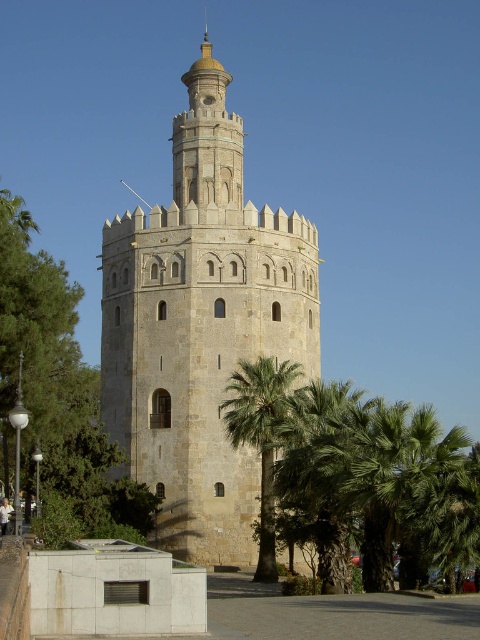
You are standing on the paved area in front of the Torre del Oro and want to take a photo of the tower. If you position yourself so that both the green leafy tree at left and the green leafy palm tree at center appear in the frame, which tree will block the view of the tower more?

The green leafy tree at left will block the view of the tower more because it is in front of the green leafy palm tree at center.

You are a tourist standing in front of the beige stone tower at center and the green leafy palm tree at center. Which one appears taller from your perspective?

The beige stone tower at center is bigger than the green leafy palm tree at center, so the beige stone tower at center appears taller from your perspective.

You are a tourist standing in front of the beige stone tower at center and the green leafy palm tree at center. You want to take a photo that captures both objects in the frame. Which object should you focus on to ensure both are visible in the photo?

The beige stone tower at center is taller than the green leafy palm tree at center, so focusing on the beige stone tower at center will ensure both are visible in the photo.